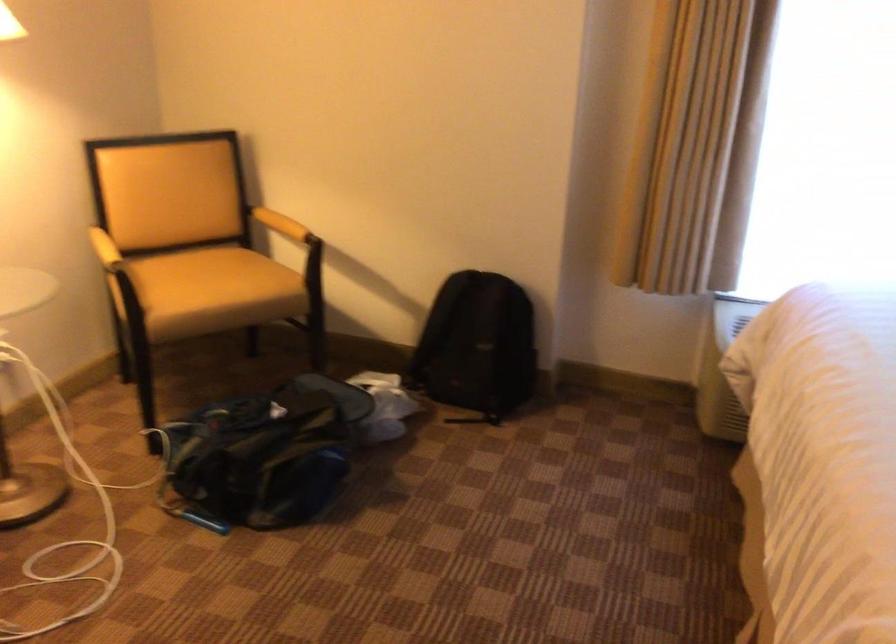
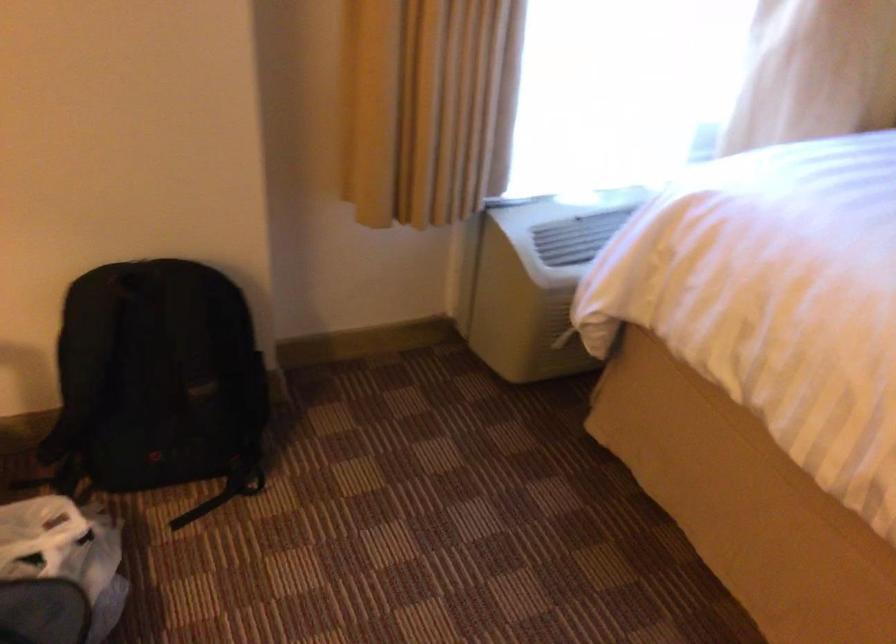
The point at (470, 278) is marked in the first image. Where is the corresponding point in the second image?

(135, 281)